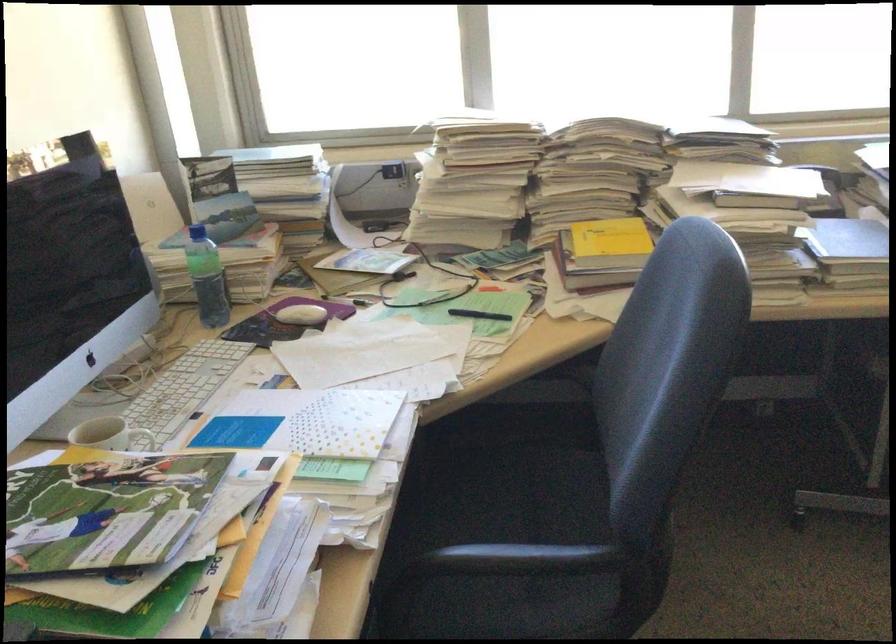
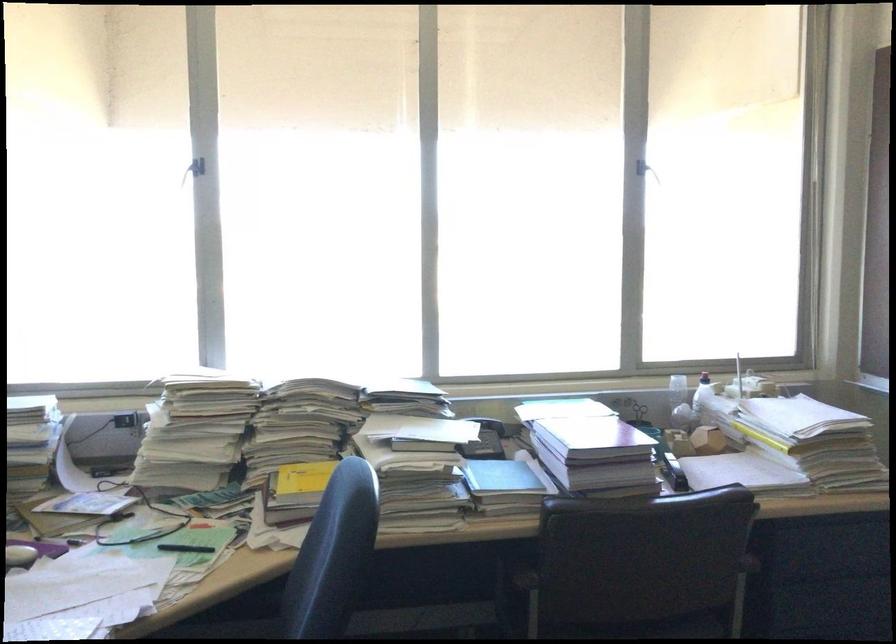
Based on the continuous images, in which direction is the camera rotating?

The rotation direction of the camera is right-up.